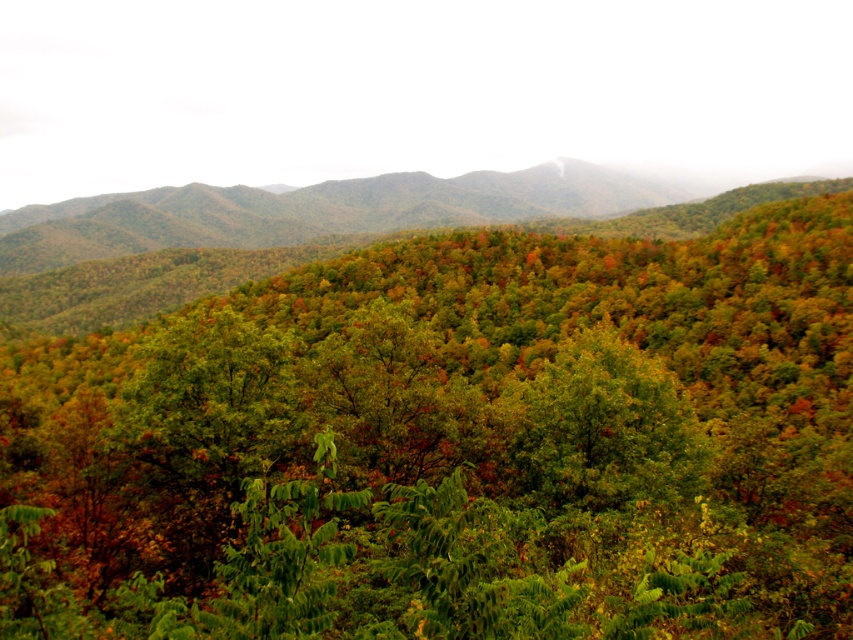
You are an environmental scientist studying tree density in the forest. You observe the green matte tree at center and the green leafy forest at center. Which of these has a greater width?

The green leafy forest at center has a greater width than the green matte tree at center.

You are standing in the forest and see two points marked in the image. Which point, point (206,371) or point (241,216), is closer to you?

Point (206,371) is closer to the camera than point (241,216).